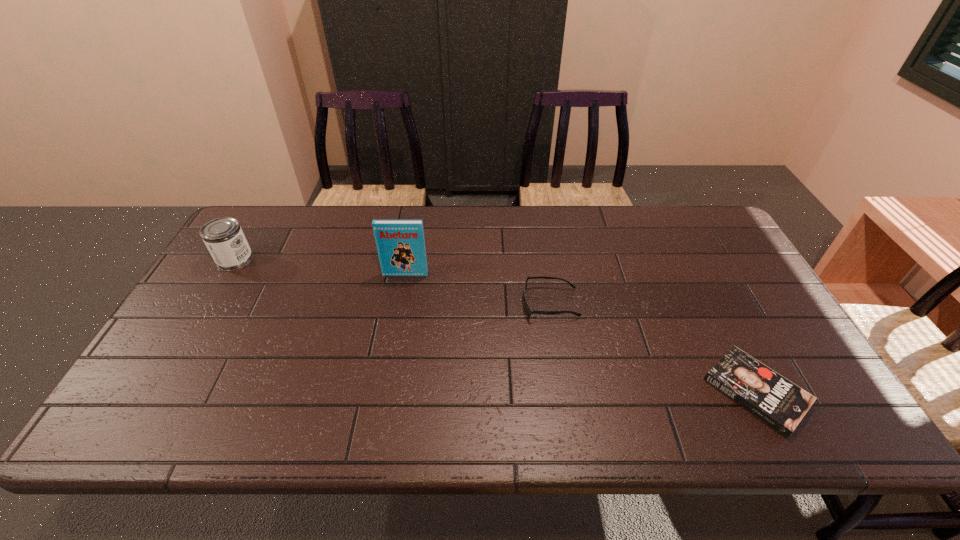
Where is `vacant space positioned on the front-facing side of the sunglasses`? The image size is (960, 540). vacant space positioned on the front-facing side of the sunglasses is located at coordinates point(429,303).

Locate an element on the screen. free space located on the front-facing side of the sunglasses is located at coordinates coord(403,303).

Find the location of `free space located on the front-facing side of the sunglasses`. free space located on the front-facing side of the sunglasses is located at coordinates pyautogui.click(x=382, y=303).

Image resolution: width=960 pixels, height=540 pixels. What are the coordinates of `vacant space positioned on the back of the shortest object` in the screenshot? It's located at (723, 327).

The height and width of the screenshot is (540, 960). What are the coordinates of `object that is at the far edge` in the screenshot? It's located at (224, 238).

The height and width of the screenshot is (540, 960). Find the location of `object that is at the near edge`. object that is at the near edge is located at coordinates (781, 404).

What are the coordinates of `object located at the left edge` in the screenshot? It's located at (224, 238).

Locate an element on the screen. This screenshot has width=960, height=540. object located in the right edge section of the desktop is located at coordinates (781, 404).

Find the location of `object at the far left corner`. object at the far left corner is located at coordinates (224, 238).

The height and width of the screenshot is (540, 960). I want to click on object that is at the near right corner, so click(781, 404).